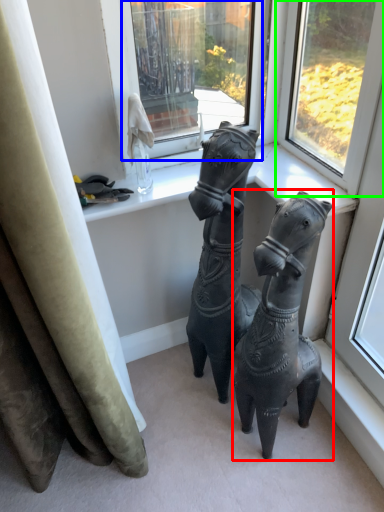
Question: Which object is positioned closest to horse (highlighted by a red box)? Select from window (highlighted by a blue box) and window (highlighted by a green box).

Choices:
 (A) window
 (B) window

Answer: (B)